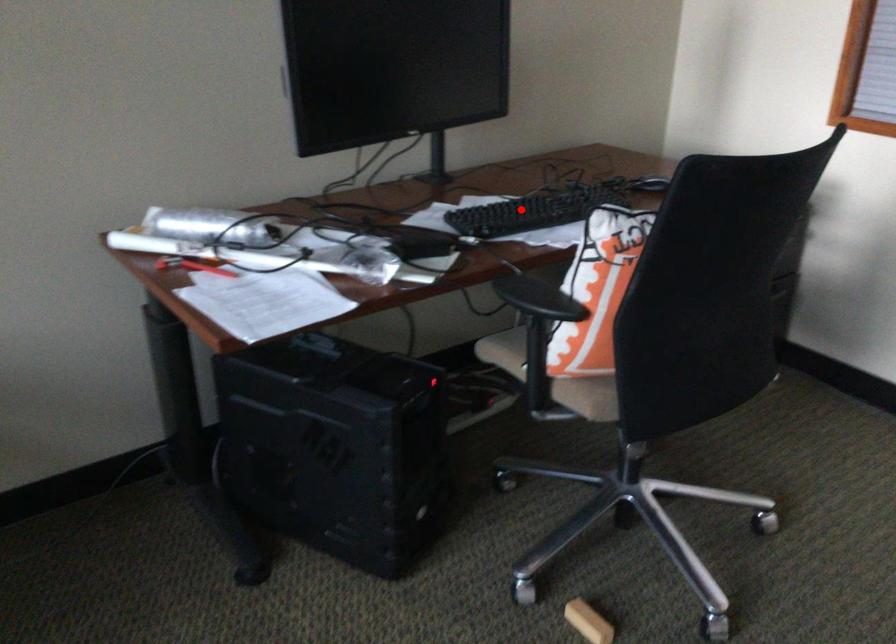
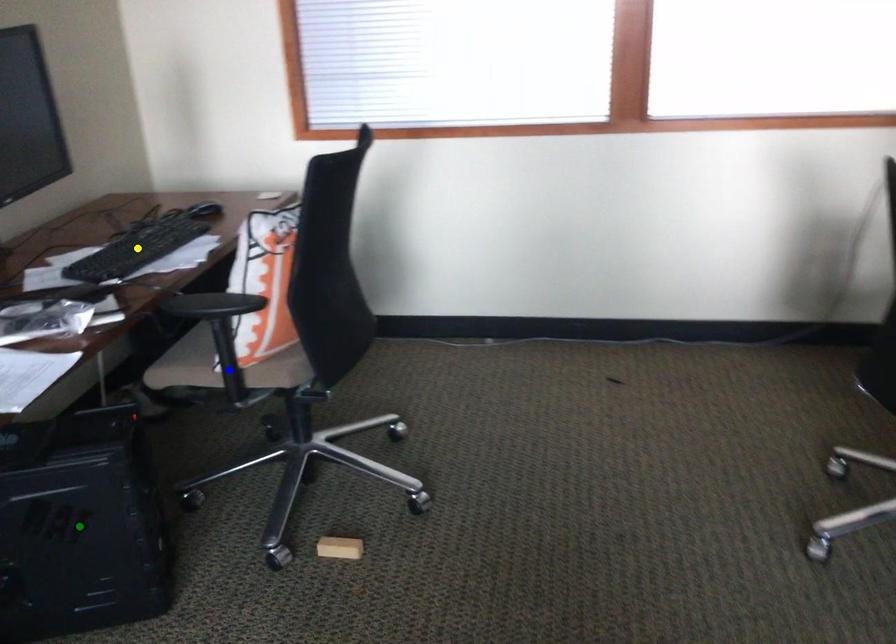
Question: I am providing you with two images of the same scene from different viewpoints. A red point is marked on the first image. You are given multiple points on the second image. Which spot in image 2 lines up with the point in image 1?

Choices:
 (A) blue point
 (B) green point
 (C) yellow point

Answer: (C)